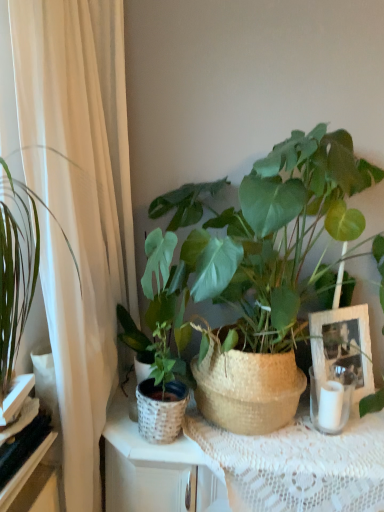
Find the location of `blank area to the left of white glass candle holder at right`. blank area to the left of white glass candle holder at right is located at coordinates (282, 431).